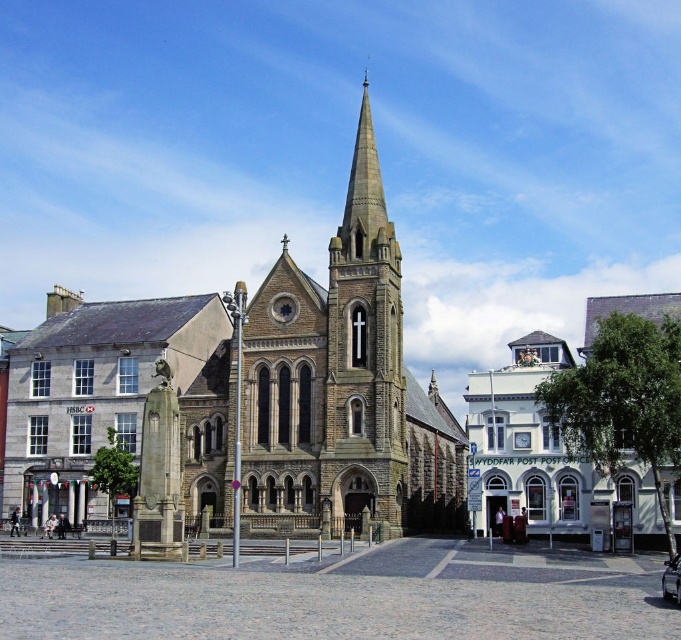
You are standing in the town square and see both the brown stone church at center and the dark gray stone tower at center. Which of these two structures is positioned to the left from your viewpoint?

The brown stone church at center is positioned to the left of the dark gray stone tower at center from your viewpoint.

You are standing in the town square and want to take a photo of the brown stone church at center. If you move 0.1 units to the right along the x axis, will the church still be in the center of your photo?

The brown stone church at center is located at point (343, 387). Moving 0.1 units to the right would change its x coordinate to 0.705. Since the center of the photo is typically at (340, 320), moving right would move the church out of the center. Therefore, the church will no longer be in the center of your photo.